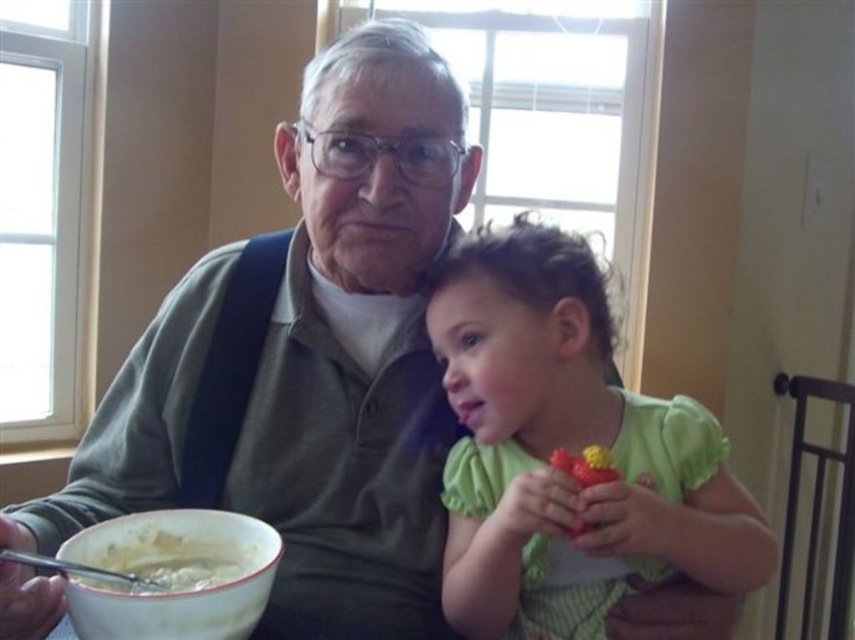
You are a parent who wants to place a small snack between the green fabric toy at right and the white glossy bowl at lower left so that it is equally accessible to both the child and the elderly man. Given the distance between them, can you estimate if the snack placed midway would be within reach for both?

The green fabric toy at right and the white glossy bowl at lower left are 13.40 inches apart from each other. Placing the snack midway would mean it is approximately 6.7 inches away from both objects. Since the elderly man and the child are seated at the table, this distance is likely within a comfortable reach for both, assuming typical arm length and positioning.